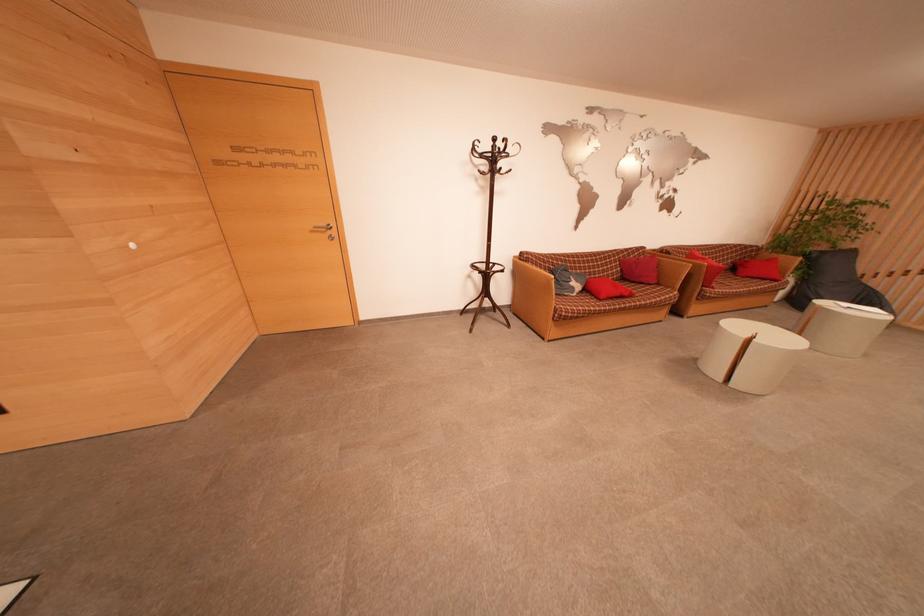
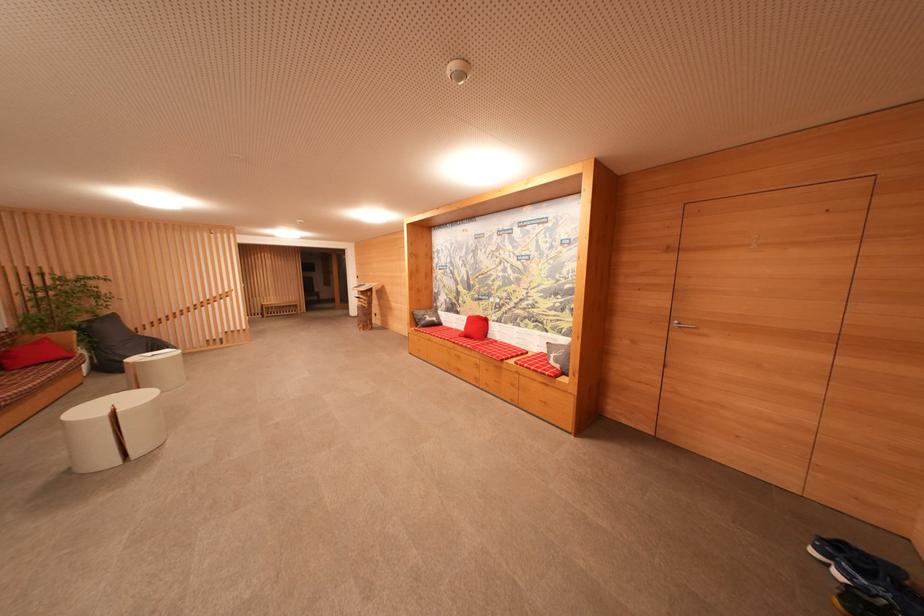
Locate, in the second image, the point that corresponds to [779,262] in the first image.

(50, 342)